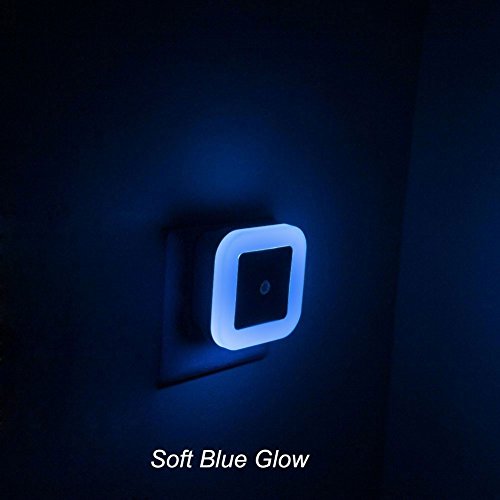
Locate an element on the screen. wall plate is located at coordinates (193, 360).